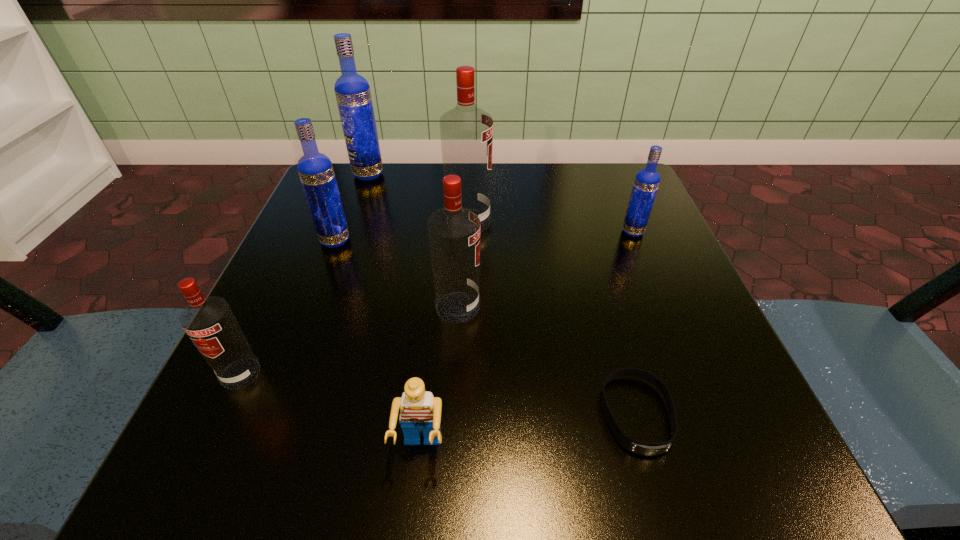
Locate an element on the screen. The height and width of the screenshot is (540, 960). Lego positioned at the near edge is located at coordinates (420, 411).

At what (x,y) coordinates should I click in order to perform the action: click on wristband situated at the near edge. Please return your answer as a coordinate pair (x, y). Image resolution: width=960 pixels, height=540 pixels. Looking at the image, I should click on (643, 448).

Image resolution: width=960 pixels, height=540 pixels. I want to click on vodka that is at the right edge, so click(x=647, y=180).

What are the coordinates of `wristband present at the right edge` in the screenshot? It's located at (643, 448).

This screenshot has width=960, height=540. I want to click on object situated at the far left corner, so click(x=352, y=91).

The height and width of the screenshot is (540, 960). Identify the location of object positioned at the near right corner. (643, 448).

At what (x,y) coordinates should I click in order to perform the action: click on free location at the near edge of the desktop. Please return your answer as a coordinate pair (x, y). The height and width of the screenshot is (540, 960). Looking at the image, I should click on coord(451,437).

Where is `free space at the left edge of the desktop`? The image size is (960, 540). free space at the left edge of the desktop is located at coordinates (294, 379).

At what (x,y) coordinates should I click in order to perform the action: click on vacant space at the right edge of the desktop. Please return your answer as a coordinate pair (x, y). This screenshot has height=540, width=960. Looking at the image, I should click on (650, 256).

In the image, there is a desktop. Where is `free space at the near left corner`? free space at the near left corner is located at coordinates (x=223, y=419).